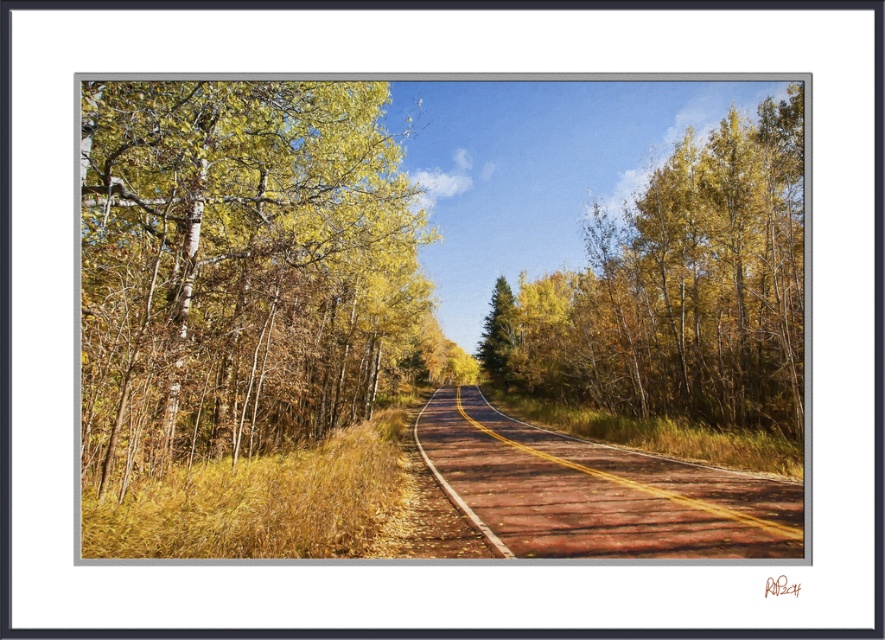
You are standing at the point labeled as point (685, 288) in the image. Looking around, you notice yellow golden bark trees at upper center. What direction should you walk to find the trees with yellow golden bark?

The point (685, 288) is already at the location of the yellow golden bark trees at upper center, so you are already among them.

You are a hiker standing on the brown wooden road at center and want to take a photo of the green matte tree at center. Which direction should you face to capture the tree in your view?

The brown wooden road at center is positioned on the left side of the green matte tree at center, so you should face to the right to capture the tree in your view.